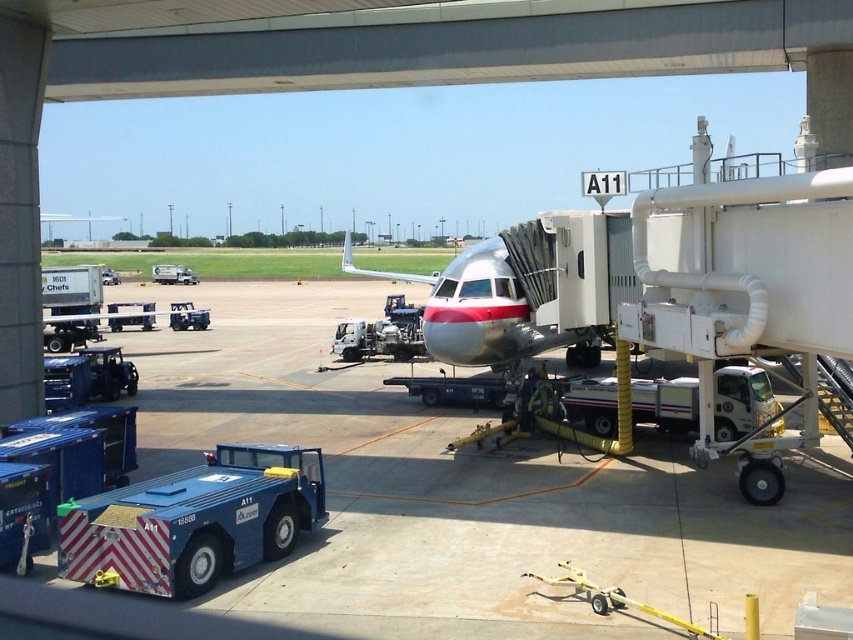
Which is more to the right, blue metallic tug at lower left or polished aluminum airplane at center?

polished aluminum airplane at center

Is blue metallic tug at lower left shorter than polished aluminum airplane at center?

Indeed, blue metallic tug at lower left has a lesser height compared to polished aluminum airplane at center.

Which is in front, point (277, 531) or point (439, 285)?

Point (277, 531)

The width and height of the screenshot is (853, 640). Find the location of `blue metallic tug at lower left`. blue metallic tug at lower left is located at coordinates (194, 520).